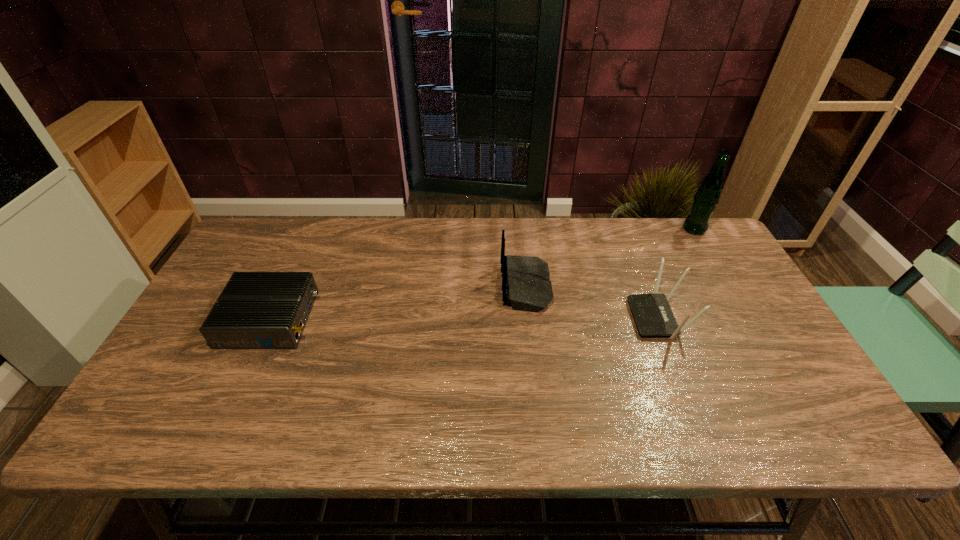
The height and width of the screenshot is (540, 960). Find the location of `vacant space at the far edge of the desktop`. vacant space at the far edge of the desktop is located at coordinates (448, 249).

The height and width of the screenshot is (540, 960). I want to click on free space at the near edge of the desktop, so click(223, 425).

Image resolution: width=960 pixels, height=540 pixels. What are the coordinates of `free space at the left edge of the desktop` in the screenshot? It's located at pyautogui.click(x=220, y=276).

Where is `free location at the right edge of the desktop`? The width and height of the screenshot is (960, 540). free location at the right edge of the desktop is located at coordinates (761, 359).

Locate an element on the screen. This screenshot has width=960, height=540. vacant area at the far left corner of the desktop is located at coordinates (299, 219).

In the image, there is a desktop. Where is `vacant space at the far right corner`? The image size is (960, 540). vacant space at the far right corner is located at coordinates (685, 252).

The image size is (960, 540). In the image, there is a desktop. What are the coordinates of `vacant space at the near right corner` in the screenshot? It's located at (830, 434).

Find the location of a particular element. The image size is (960, 540). free space between the second object from left to right and the farthest object is located at coordinates (611, 258).

Find the location of a particular element. The height and width of the screenshot is (540, 960). empty space between the farthest object and the second router from left to right is located at coordinates coord(611,258).

This screenshot has width=960, height=540. I want to click on vacant space in between the second object from left to right and the beer bottle, so click(x=611, y=258).